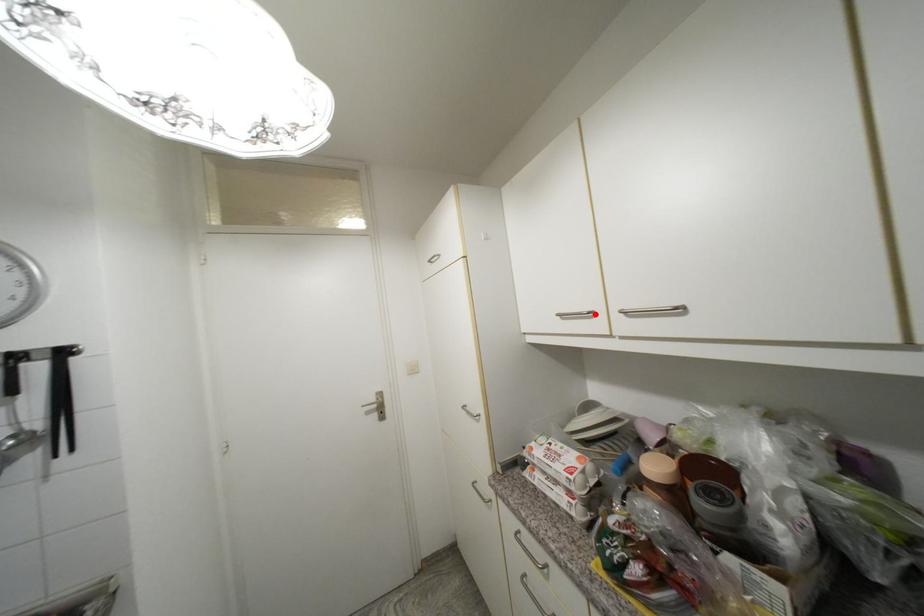
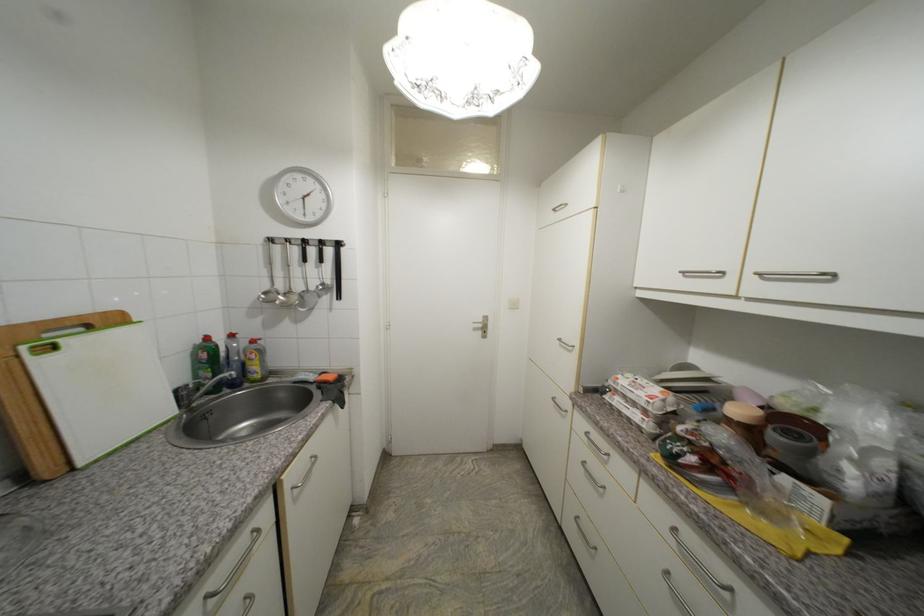
The point at the highlighted location is marked in the first image. Where is the corresponding point in the second image?

(724, 274)